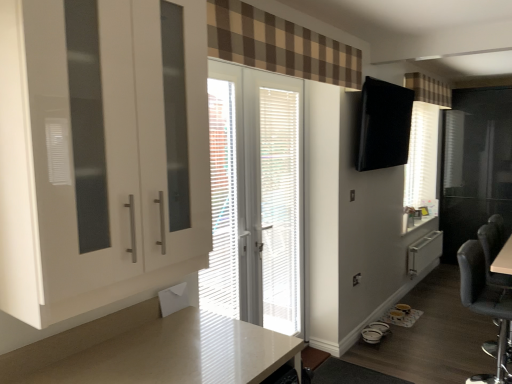
Find the location of a particular element. Image resolution: width=512 pixels, height=384 pixels. free point above white glossy countertop at lower center (from a real-world perspective) is located at coordinates (180, 349).